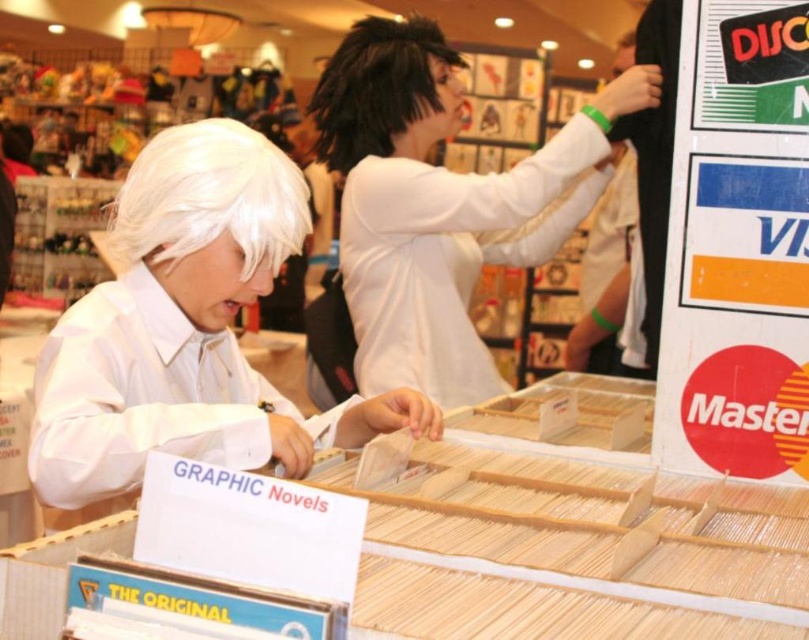
Is white matte wig at center smaller than white synthetic wig at left?

No, white matte wig at center is not smaller than white synthetic wig at left.

Can you confirm if white matte wig at center is positioned below white synthetic wig at left?

Yes.

Is point (426, 435) closer to camera compared to point (109, 216)?

That is True.

I want to click on white matte wig at center, so click(185, 330).

Measure the distance from sleek black wig at upper center to white synthetic wig at left.

sleek black wig at upper center and white synthetic wig at left are 31.74 inches apart.

Between sleek black wig at upper center and white synthetic wig at left, which one appears on the left side from the viewer's perspective?

From the viewer's perspective, white synthetic wig at left appears more on the left side.

The width and height of the screenshot is (809, 640). What do you see at coordinates (441, 202) in the screenshot?
I see `sleek black wig at upper center` at bounding box center [441, 202].

Identify the location of sleek black wig at upper center. Image resolution: width=809 pixels, height=640 pixels. (441, 202).

Can you confirm if white synthetic wig at left is positioned below slick black wig at upper center?

Yes, white synthetic wig at left is below slick black wig at upper center.

Who is more distant from viewer, (244, 166) or (420, 90)?

The point (420, 90) is more distant.

Image resolution: width=809 pixels, height=640 pixels. What are the coordinates of `white synthetic wig at left` in the screenshot? It's located at (210, 196).